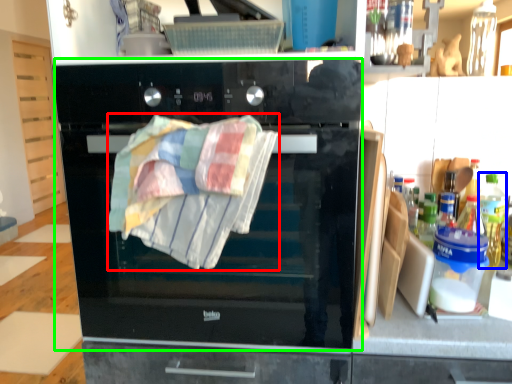
Question: Which is nearer to the beach towel (highlighted by a red box)? bottle (highlighted by a blue box) or oven (highlighted by a green box).

Choices:
 (A) bottle
 (B) oven

Answer: (B)